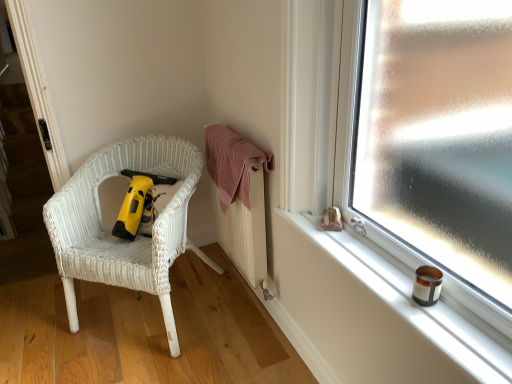
Find the location of `vacant space situated above smooth white window sill at right (from a real-world perspective)`. vacant space situated above smooth white window sill at right (from a real-world perspective) is located at coordinates (377, 275).